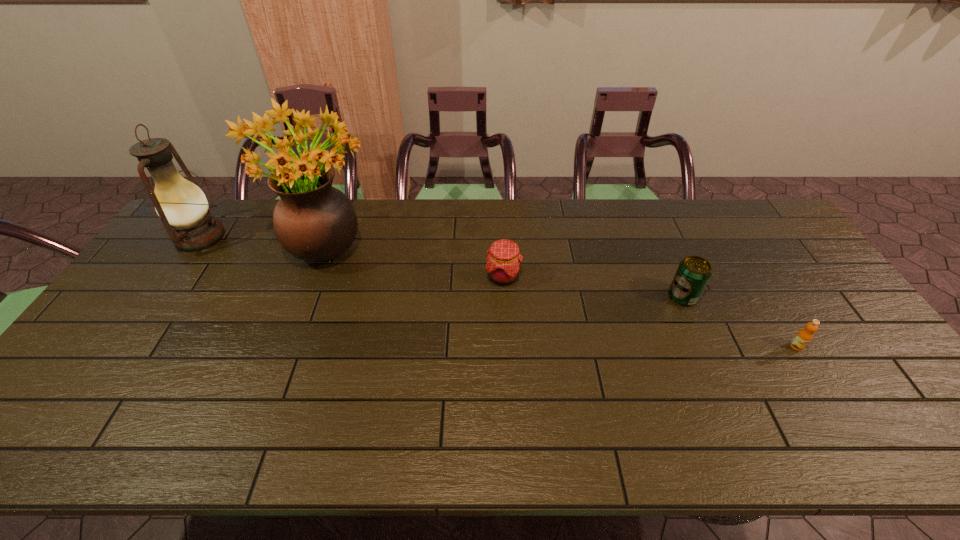
The width and height of the screenshot is (960, 540). What are the coordinates of `vacant area that lies between the leftmost object and the beer can` in the screenshot? It's located at (442, 267).

Where is `vacant area between the flower arrangement and the jam`? This screenshot has width=960, height=540. vacant area between the flower arrangement and the jam is located at coordinates (415, 261).

The image size is (960, 540). Find the location of `vacant point located between the leftmost object and the beer can`. vacant point located between the leftmost object and the beer can is located at coordinates (442, 267).

Image resolution: width=960 pixels, height=540 pixels. In order to click on unoccupied position between the flower arrangement and the rightmost object in this screenshot , I will do `click(561, 296)`.

In order to click on unoccupied position between the rightmost object and the third object from left to right in this screenshot , I will do `click(650, 312)`.

The image size is (960, 540). I want to click on free space between the flower arrangement and the nearest object, so [561, 296].

Where is `empty space between the beer can and the third object from left to right`? The height and width of the screenshot is (540, 960). empty space between the beer can and the third object from left to right is located at coordinates (593, 287).

Where is `vacant area between the oil lamp and the flower arrangement`? This screenshot has width=960, height=540. vacant area between the oil lamp and the flower arrangement is located at coordinates (263, 241).

Identify the location of free spot between the fourth object from right to left and the oil lamp. (263, 241).

At what (x,y) coordinates should I click in order to perform the action: click on free spot between the orange juice and the fourth object from right to left. Please return your answer as a coordinate pair (x, y). Looking at the image, I should click on [x=561, y=296].